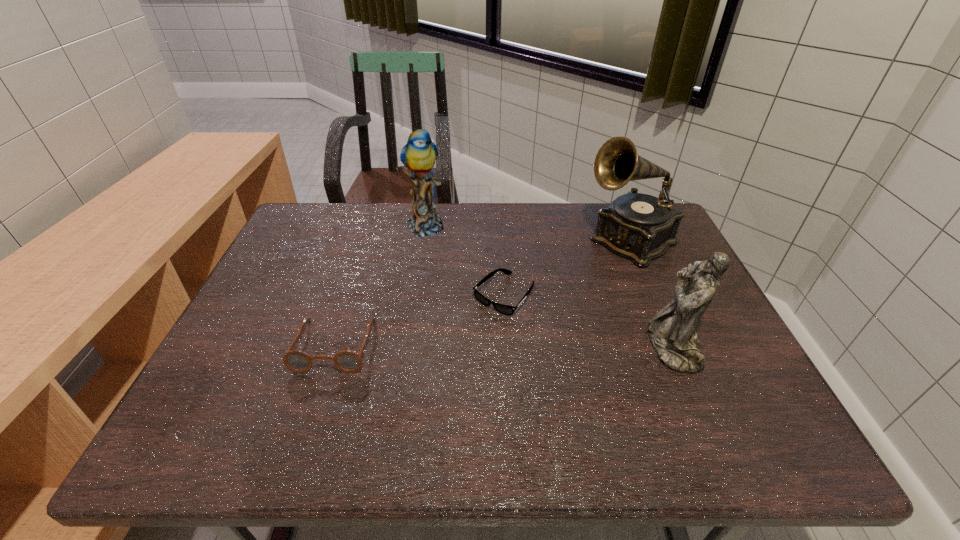
The image size is (960, 540). In order to click on free space on the desktop that is between the fourth tallest object and the third tallest object and is positioned on the horn of the phonograph record in this screenshot , I will do point(475,346).

Find the location of a particular element. free spot on the desktop that is between the leftmost object and the third shortest object and is positioned on the face of the parrot is located at coordinates (535, 346).

The width and height of the screenshot is (960, 540). In order to click on vacant space on the desktop that is between the leftmost object and the third tallest object and is positioned on the front-facing side of the third object from right to left in this screenshot , I will do `click(456, 346)`.